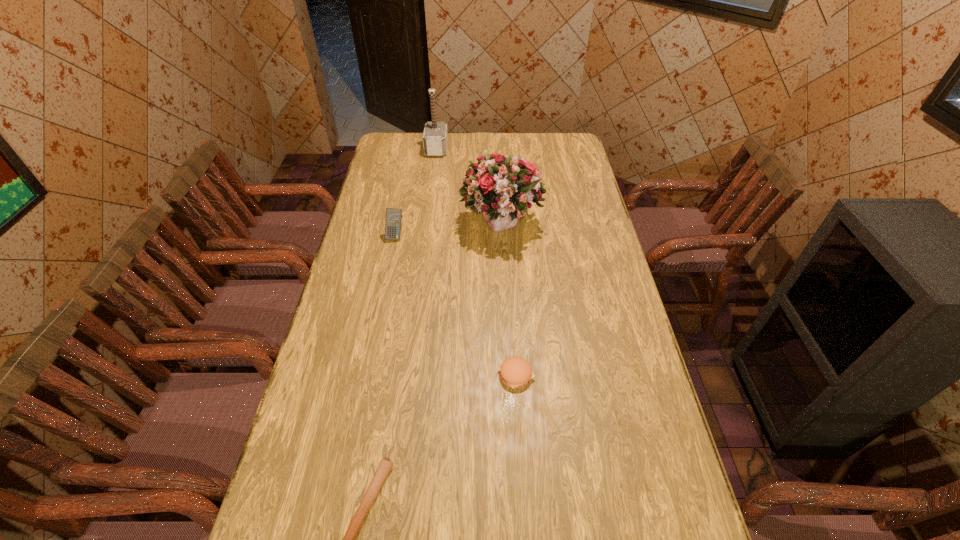
This screenshot has width=960, height=540. Find the location of `free spot between the bouquet and the third tallest object`. free spot between the bouquet and the third tallest object is located at coordinates pos(448,231).

Locate an element on the screen. This screenshot has width=960, height=540. the third closest object to the third shortest object is located at coordinates (515, 372).

Find the location of a particular element. This screenshot has width=960, height=540. object that stands as the fourth closest to the second shortest object is located at coordinates (435, 137).

At what (x,y) coordinates should I click in order to perform the action: click on free region that satisfies the following two spatial constraints: 1. on the front-facing side of the fourth tallest object; 2. on the left side of the calculator. Please return your answer as a coordinate pair (x, y). Image resolution: width=960 pixels, height=540 pixels. Looking at the image, I should click on (368, 375).

The width and height of the screenshot is (960, 540). I want to click on vacant region that satisfies the following two spatial constraints: 1. on the front-facing side of the patty; 2. on the left side of the third tallest object, so click(x=368, y=375).

This screenshot has height=540, width=960. I want to click on free space that satisfies the following two spatial constraints: 1. for striking with the head of the farther hammer; 2. on the right side of the bouquet, so click(426, 225).

Find the location of a particular element. vacant point that satisfies the following two spatial constraints: 1. on the front side of the bouquet; 2. on the right side of the fourth tallest object is located at coordinates (509, 375).

I want to click on free space that satisfies the following two spatial constraints: 1. for striking with the head of the taller hammer; 2. on the front-facing side of the calculator, so click(x=425, y=237).

Image resolution: width=960 pixels, height=540 pixels. I want to click on free spot that satisfies the following two spatial constraints: 1. on the front side of the fourth tallest object; 2. on the right side of the bouquet, so click(x=509, y=375).